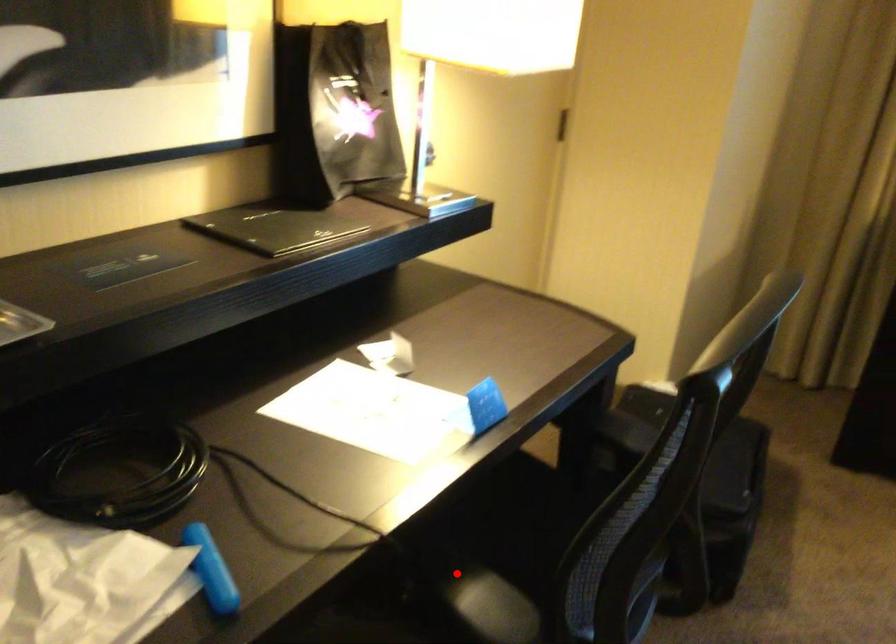
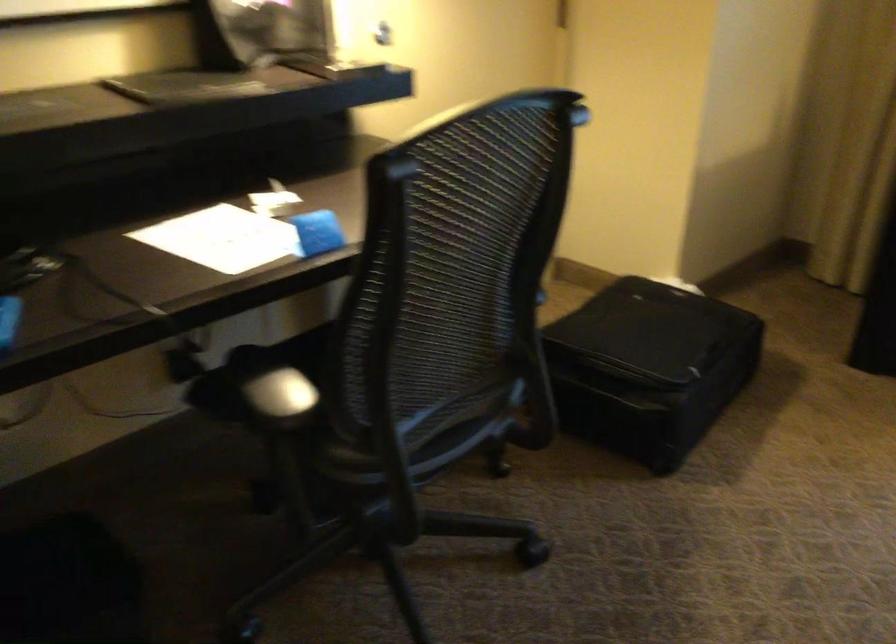
The point at the highlighted location is marked in the first image. Where is the corresponding point in the second image?

(259, 371)